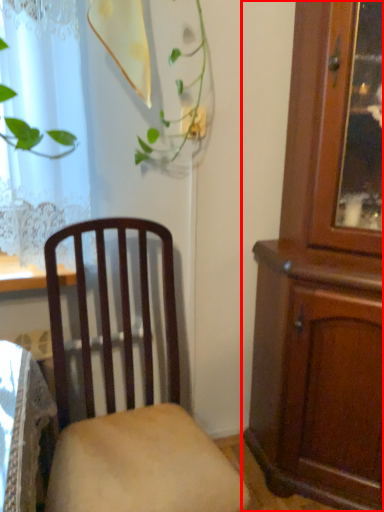
Question: Considering the relative positions of cabinetry (annotated by the red box) and chair in the image provided, where is cabinetry (annotated by the red box) located with respect to the staircase?

Choices:
 (A) right
 (B) left

Answer: (A)